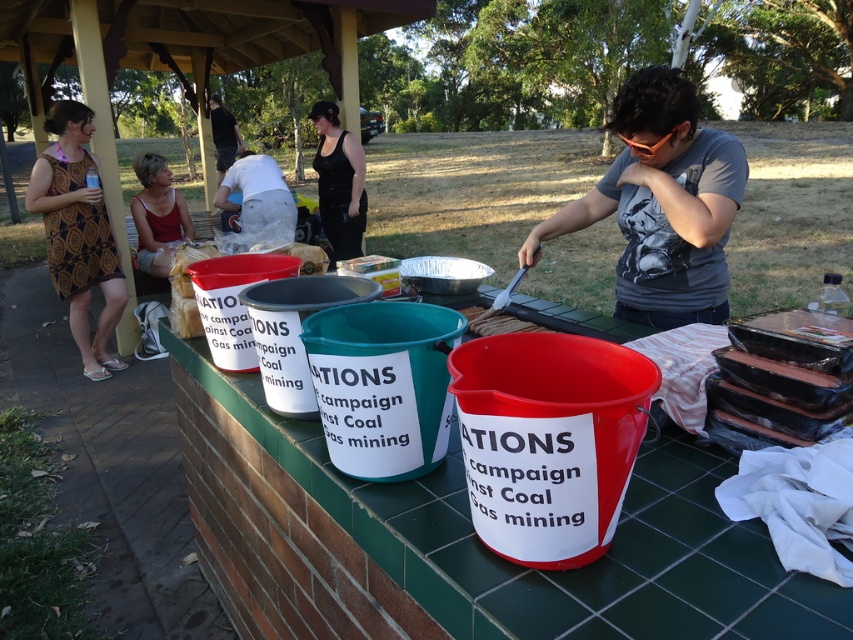
Question: Which point is closer to the camera taking this photo?

Choices:
 (A) (321, 186)
 (B) (76, 266)
 (C) (155, 192)

Answer: (B)

Question: Does patterned fabric dress at left appear on the left side of matte red tank top at left?

Choices:
 (A) yes
 (B) no

Answer: (A)

Question: Is patterned fabric dress at left smaller than matte red tank top at left?

Choices:
 (A) no
 (B) yes

Answer: (A)

Question: Which point is farther to the camera?

Choices:
 (A) (158, 202)
 (B) (44, 170)
 (C) (344, 209)

Answer: (C)

Question: Which point is farther to the camera?

Choices:
 (A) black fabric at center
 (B) patterned fabric dress at left
 (C) matte red tank top at left

Answer: (A)

Question: Can you confirm if patterned fabric dress at left is wider than matte red tank top at left?

Choices:
 (A) no
 (B) yes

Answer: (B)